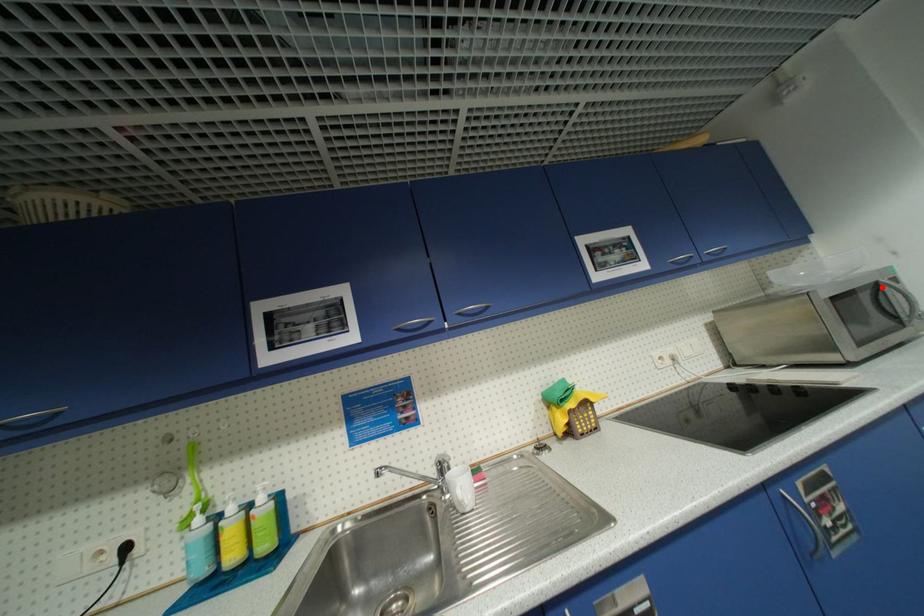
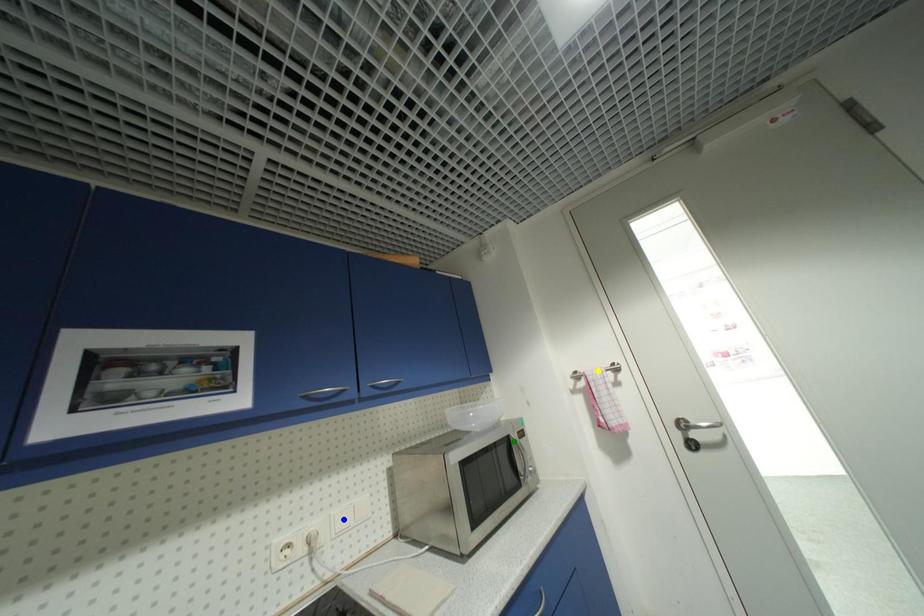
Question: I am providing you with two images of the same scene from different viewpoints. A red point is marked on the first image. You are given multiple points on the second image. In image 2, which mark is for the same physical point as the one in image 1?

Choices:
 (A) blue point
 (B) yellow point
 (C) green point

Answer: (C)